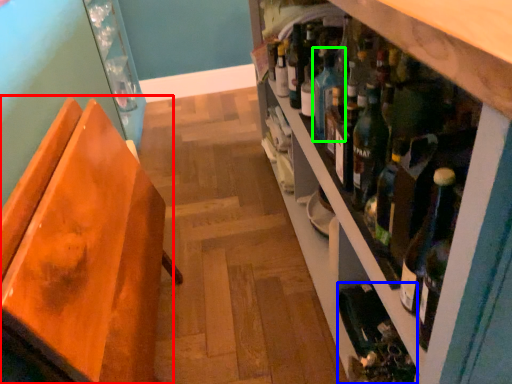
Question: Which object is the closest to the chair (highlighted by a red box)? Choose among these: wine bottle (highlighted by a blue box) or teal (highlighted by a green box).

Choices:
 (A) wine bottle
 (B) teal

Answer: (B)